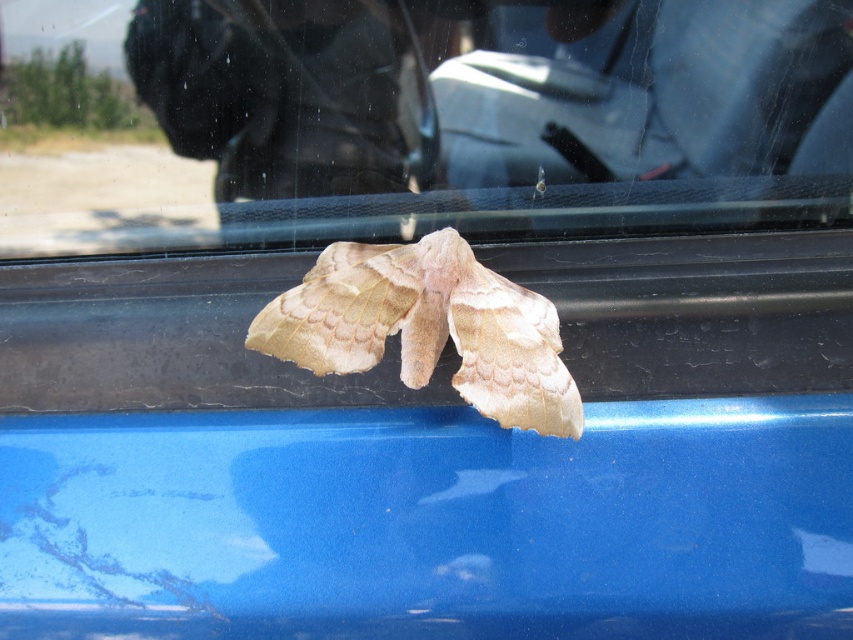
Who is taller, transparent glass moth at center or fuzzy beige moth at center?

transparent glass moth at center is taller.

Does transparent glass moth at center have a greater width compared to fuzzy beige moth at center?

Yes, transparent glass moth at center is wider than fuzzy beige moth at center.

Locate an element on the screen. The width and height of the screenshot is (853, 640). transparent glass moth at center is located at coordinates (415, 116).